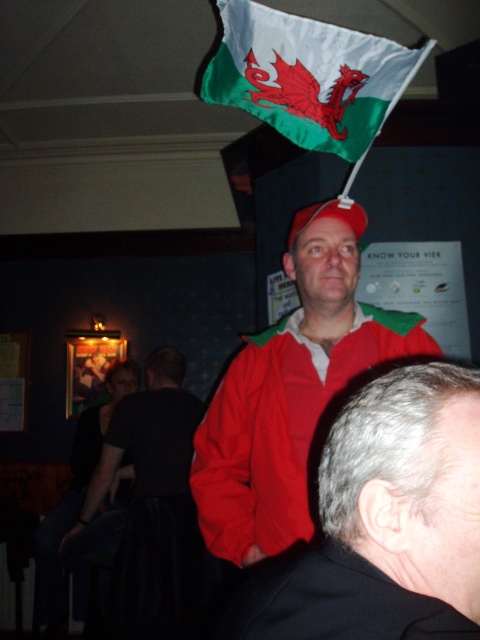
Can you confirm if smooth red jacket at center is shorter than black matte dress at lower left?

Correct, smooth red jacket at center is not as tall as black matte dress at lower left.

Is smooth red jacket at center bigger than black matte dress at lower left?

No, smooth red jacket at center is not bigger than black matte dress at lower left.

You are a GUI agent. You are given a task and a screenshot of the screen. Output one action in this format:
    pyautogui.click(x=<x>, y=<y>)
    Task: Click on the smooth red jacket at center
    
    Given the screenshot: What is the action you would take?
    pyautogui.click(x=384, y=522)

Locate an element on the screen. This screenshot has width=480, height=640. smooth red jacket at center is located at coordinates (384, 522).

Is matte red jacket at center shorter than whitematerial/textureflag at upper center?

No, matte red jacket at center is not shorter than whitematerial/textureflag at upper center.

In the scene shown: Who is more distant from viewer, [252,500] or [377,128]?

Positioned behind is point [377,128].

The width and height of the screenshot is (480, 640). Find the location of `matte red jacket at center`. matte red jacket at center is located at coordinates (292, 392).

Can you confirm if smooth red jacket at center is positioned to the left of whitematerial/textureflag at upper center?

In fact, smooth red jacket at center is to the right of whitematerial/textureflag at upper center.

Does smooth red jacket at center appear over whitematerial/textureflag at upper center?

Actually, smooth red jacket at center is below whitematerial/textureflag at upper center.

Which is behind, point (447, 464) or point (418, 67)?

Positioned behind is point (418, 67).

Locate an element on the screen. Image resolution: width=480 pixels, height=640 pixels. smooth red jacket at center is located at coordinates (384, 522).